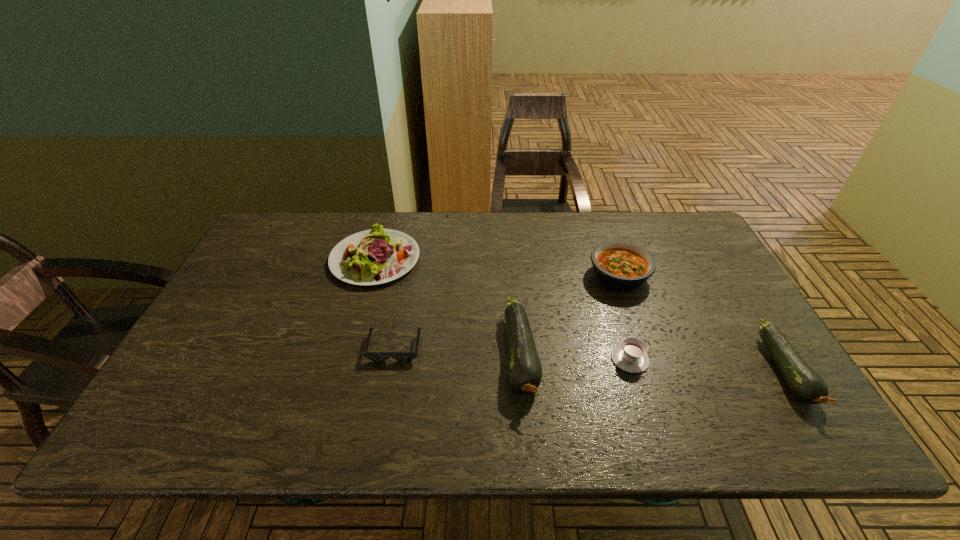
This screenshot has width=960, height=540. In order to click on vacant space that is in between the shortest object and the taller zucchini in this screenshot , I will do `click(458, 352)`.

Find the location of a particular element. The image size is (960, 540). unoccupied area between the teacup and the stew is located at coordinates (624, 317).

Where is `object that stands as the second closest to the right zucchini`? The height and width of the screenshot is (540, 960). object that stands as the second closest to the right zucchini is located at coordinates (630, 356).

Identify which object is located as the second nearest to the taller zucchini. Please provide its 2D coordinates. Your answer should be formatted as a tuple, i.e. [(x, y)], where the tuple contains the x and y coordinates of a point satisfying the conditions above.

[(620, 265)]

Identify the location of free space that satisfies the following two spatial constraints: 1. on the handle side of the stew; 2. on the right side of the fifth tallest object. (604, 275).